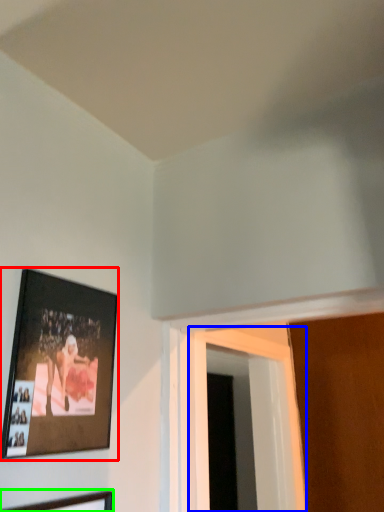
Question: Which object is positioned closest to picture frame (highlighted by a red box)? Select from window (highlighted by a blue box) and picture frame (highlighted by a green box).

Choices:
 (A) window
 (B) picture frame

Answer: (B)